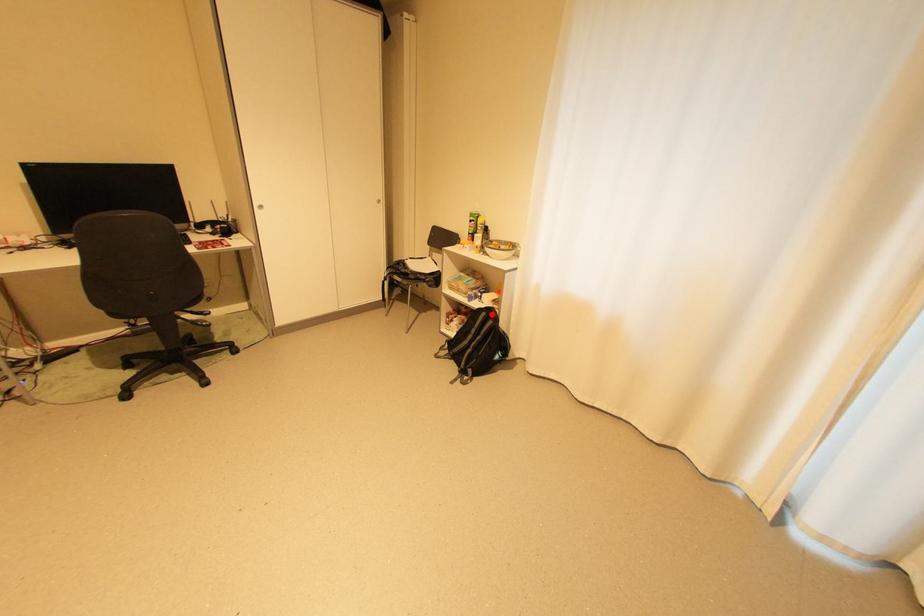
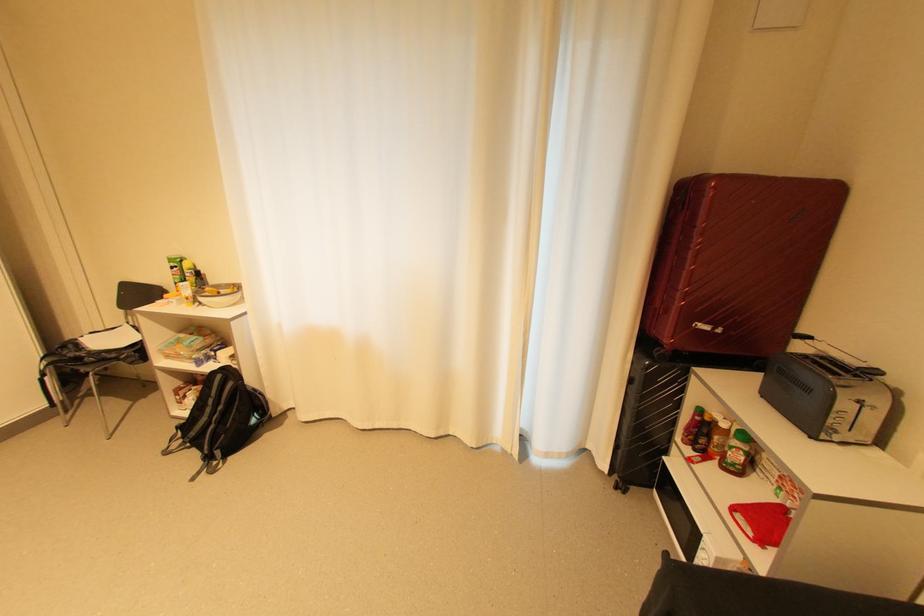
Where in the second image is the point corresponding to the highlighted location from the first image?

(226, 377)